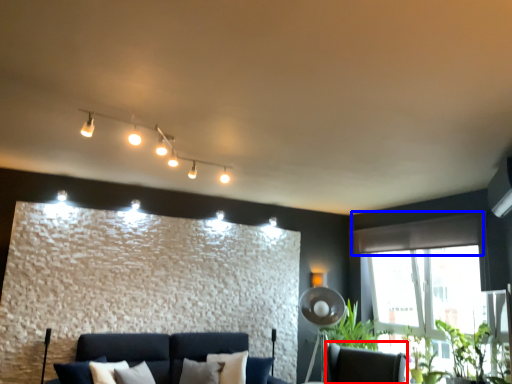
Question: Which of the following is the closest to the observer, swivel chair (highlighted by a red box) or curtain (highlighted by a blue box)?

Choices:
 (A) swivel chair
 (B) curtain

Answer: (A)